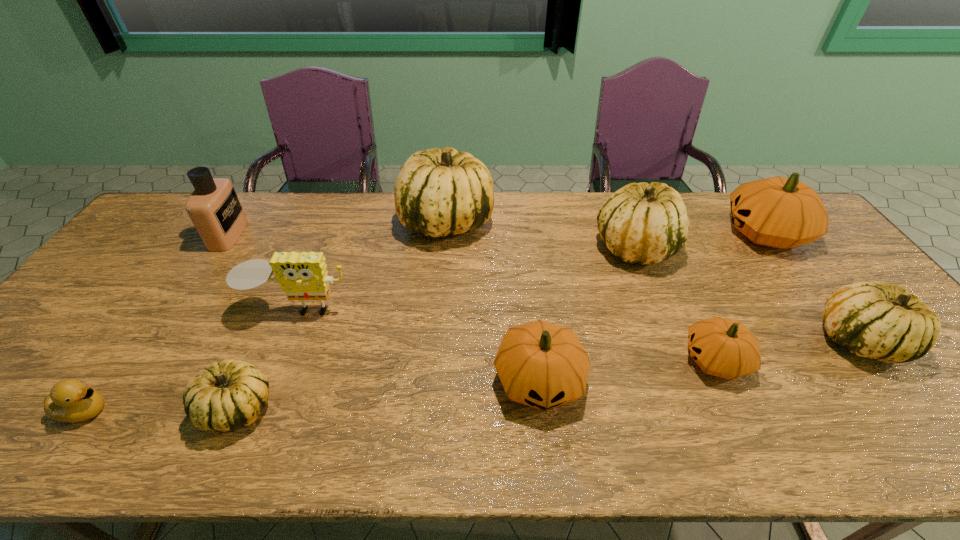
The width and height of the screenshot is (960, 540). I want to click on the second closest orange gourd to the smallest white gourd, so click(721, 347).

Where is `vacant position in the image that satisfies the following two spatial constraints: 1. on the side of the smallest orange gourd with the carved face; 2. on the side of the second biggest orange gourd with the carved face`? The height and width of the screenshot is (540, 960). vacant position in the image that satisfies the following two spatial constraints: 1. on the side of the smallest orange gourd with the carved face; 2. on the side of the second biggest orange gourd with the carved face is located at coordinates (725, 380).